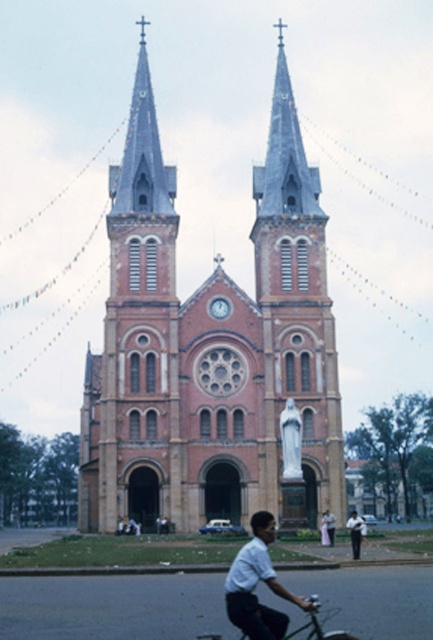
Question: Which of the following is the closest to the observer?

Choices:
 (A) (361, 534)
 (B) (249, 612)

Answer: (B)

Question: Does white matte shirt at lower center appear over metallic silver bicycle at lower center?

Choices:
 (A) yes
 (B) no

Answer: (A)

Question: Does brown brick church at center appear on the left side of white matte shirt at lower center?

Choices:
 (A) no
 (B) yes

Answer: (B)

Question: Does white matte shirt at lower center have a lesser width compared to white cotton shirt at lower center?

Choices:
 (A) yes
 (B) no

Answer: (B)

Question: Which point is closer to the camera?

Choices:
 (A) (309, 595)
 (B) (355, 518)
 (C) (248, 580)

Answer: (C)

Question: Which of the following is the closest to the observer?

Choices:
 (A) (180, 429)
 (B) (312, 598)
 (C) (352, 513)
 (D) (232, 568)

Answer: (D)